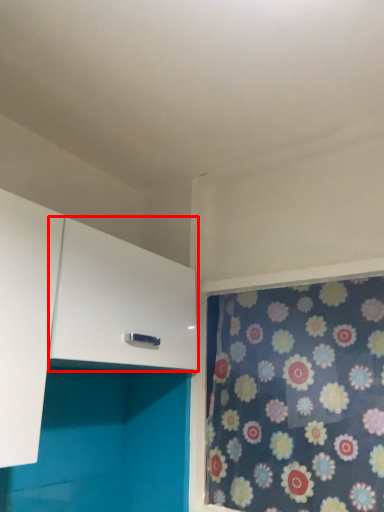
Question: From the image's perspective, what is the correct spatial positioning of cabinetry (annotated by the red box) in reference to curtain?

Choices:
 (A) above
 (B) below

Answer: (A)